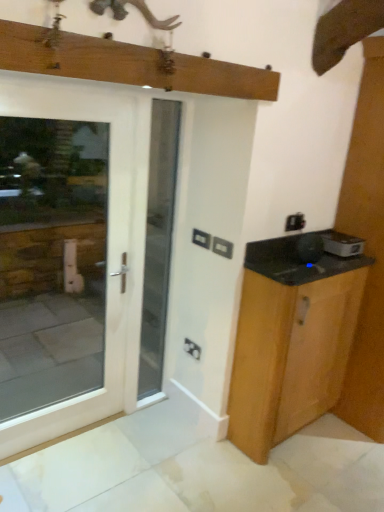
This screenshot has height=512, width=384. What are the coordinates of `wooden beam at upper center` in the screenshot? It's located at (129, 64).

Measure the distance between matte black electric outlet at center, which is the 1th electric outlet in bottom-to-top order, and camera.

matte black electric outlet at center, which is the 1th electric outlet in bottom-to-top order, and camera are 8.20 feet apart from each other.

What do you see at coordinates (192, 349) in the screenshot?
I see `matte black electric outlet at center, the 1th electric outlet viewed from the back` at bounding box center [192, 349].

The width and height of the screenshot is (384, 512). What do you see at coordinates (291, 339) in the screenshot? I see `wooden cabinet at right` at bounding box center [291, 339].

I want to click on black plastic electric outlet at center, the 2th electric outlet positioned from the bottom, so click(x=222, y=247).

What do you see at coordinates (62, 257) in the screenshot? This screenshot has width=384, height=512. I see `white wood door at left` at bounding box center [62, 257].

The width and height of the screenshot is (384, 512). What do you see at coordinates (158, 242) in the screenshot? I see `white glossy door at center` at bounding box center [158, 242].

This screenshot has height=512, width=384. What do you see at coordinates (201, 238) in the screenshot? I see `white plastic electric outlet at center, marked as the 2th electric outlet in a back-to-front arrangement` at bounding box center [201, 238].

Identify the location of wooden beam at upper center. (129, 64).

How different are the orientations of wooden cabinet at right and matte black electric outlet at center, which appears as the third electric outlet when viewed from the top, in degrees?

The angle between the facing direction of wooden cabinet at right and the facing direction of matte black electric outlet at center, which appears as the third electric outlet when viewed from the top, is 89.5 degrees.

Which of these two, wooden cabinet at right or matte black electric outlet at center, the 1th electric outlet viewed from the back, stands taller?

Standing taller between the two is wooden cabinet at right.

Does point (309, 353) lie behind point (188, 342)?

No.

From the image's perspective, starting from the white glossy microwave at right, which electric outlet is the 2nd one below? Please provide its 2D coordinates.

[(192, 349)]

Based on the photo, between white glossy microwave at right and matte black electric outlet at center, which appears as the third electric outlet when viewed from the top, which one appears on the right side from the viewer's perspective?

white glossy microwave at right is more to the right.

Which of these two, white glossy microwave at right or matte black electric outlet at center, which is the 1th electric outlet in bottom-to-top order, is wider?

With larger width is white glossy microwave at right.

From their relative heights in the image, would you say white glossy microwave at right is taller or shorter than matte black electric outlet at center, which is the 3th electric outlet from front to back?

In the image, white glossy microwave at right appears to be shorter than matte black electric outlet at center, which is the 3th electric outlet from front to back.

How many degrees apart are the facing directions of white wood door at left and white plastic electric outlet at center, which is counted as the second electric outlet, starting from the front?

88.5 degrees separate the facing orientations of white wood door at left and white plastic electric outlet at center, which is counted as the second electric outlet, starting from the front.

Is white wood door at left wider or thinner than white plastic electric outlet at center, which is counted as the second electric outlet, starting from the front?

Considering their sizes, white wood door at left looks broader than white plastic electric outlet at center, which is counted as the second electric outlet, starting from the front.

From a real-world perspective, does white wood door at left sit lower than white plastic electric outlet at center, which is counted as the second electric outlet, starting from the front?

Yes, from a real-world perspective, white wood door at left is below white plastic electric outlet at center, which is counted as the second electric outlet, starting from the front.

Is white wood door at left aimed at white plastic electric outlet at center, which is counted as the second electric outlet, starting from the front?

No, white wood door at left does not turn towards white plastic electric outlet at center, which is counted as the second electric outlet, starting from the front.

From the image's perspective, does white wood door at left appear lower than wooden beam at upper center?

Yes, from the image's perspective, white wood door at left is beneath wooden beam at upper center.

Does white wood door at left come behind wooden beam at upper center?

Yes.

From a real-world perspective, who is located lower, white wood door at left or wooden beam at upper center?

In real-world perspective, white wood door at left is lower.

Can you tell me how much white wood door at left and wooden beam at upper center differ in facing direction?

0.00685 degrees.

Is wooden beam at upper center thinner than white plastic electric outlet at center, the first electric outlet when ordered from top to bottom?

Incorrect, the width of wooden beam at upper center is not less than that of white plastic electric outlet at center, the first electric outlet when ordered from top to bottom.

How far apart are wooden beam at upper center and white plastic electric outlet at center, which is counted as the second electric outlet, starting from the front?

The distance of wooden beam at upper center from white plastic electric outlet at center, which is counted as the second electric outlet, starting from the front, is 38.62 inches.

Is wooden beam at upper center not inside white plastic electric outlet at center, which is counted as the second electric outlet, starting from the front?

Indeed, wooden beam at upper center is completely outside white plastic electric outlet at center, which is counted as the second electric outlet, starting from the front.

Is wooden beam at upper center not near white plastic electric outlet at center, marked as the 2th electric outlet in a back-to-front arrangement?

wooden beam at upper center is actually quite close to white plastic electric outlet at center, marked as the 2th electric outlet in a back-to-front arrangement.

Is white glossy microwave at right smaller than white plastic electric outlet at center, which is counted as the second electric outlet, starting from the front?

Incorrect, white glossy microwave at right is not smaller in size than white plastic electric outlet at center, which is counted as the second electric outlet, starting from the front.

Which of these two, white glossy microwave at right or white plastic electric outlet at center, the third electric outlet in the bottom-to-top sequence, stands shorter?

Standing shorter between the two is white plastic electric outlet at center, the third electric outlet in the bottom-to-top sequence.

From the image's perspective, between white glossy microwave at right and white plastic electric outlet at center, marked as the 2th electric outlet in a back-to-front arrangement, which one is located above?

white plastic electric outlet at center, marked as the 2th electric outlet in a back-to-front arrangement.

Find the location of `screen door above the wooden cabinet at right (from a real-world perspective)`. screen door above the wooden cabinet at right (from a real-world perspective) is located at coordinates coord(158,242).

In terms of width, does wooden cabinet at right look wider or thinner when compared to white glossy door at center?

Considering their sizes, wooden cabinet at right looks broader than white glossy door at center.

Does point (246, 314) come in front of point (142, 347)?

Yes, point (246, 314) is closer to viewer.

Consider the image. Between wooden cabinet at right and white glossy door at center, which one has larger size?

wooden cabinet at right.

Find the location of a particular element. cabinetry lying above the matte black electric outlet at center, which is the 1th electric outlet in bottom-to-top order (from the image's perspective) is located at coordinates (291, 339).

At what (x,y) coordinates should I click in order to perform the action: click on appliance above the matte black electric outlet at center, which is the 3th electric outlet from front to back (from a real-world perspective). Please return your answer as a coordinate pair (x, y). Looking at the image, I should click on (342, 244).

In the scene shown: Based on their spatial positions, is white glossy door at center or wooden cabinet at right further from white wood door at left?

wooden cabinet at right.

Based on their spatial positions, is matte black electric outlet at center, which appears as the third electric outlet when viewed from the top, or white plastic electric outlet at center, which is counted as the second electric outlet, starting from the front, further from wooden cabinet at right?

Among the two, white plastic electric outlet at center, which is counted as the second electric outlet, starting from the front, is located further to wooden cabinet at right.

Looking at the image, which one is located closer to white glossy door at center, black plastic electric outlet at center, acting as the third electric outlet starting from the back, or matte black electric outlet at center, which is the 3th electric outlet from front to back?

Based on the image, matte black electric outlet at center, which is the 3th electric outlet from front to back, appears to be nearer to white glossy door at center.

When comparing their distances from white glossy microwave at right, does white plastic electric outlet at center, marked as the 2th electric outlet in a back-to-front arrangement, or matte black electric outlet at center, which is the 3th electric outlet from front to back, seem closer?

Based on the image, white plastic electric outlet at center, marked as the 2th electric outlet in a back-to-front arrangement, appears to be nearer to white glossy microwave at right.

Based on the photo, from the image, which object appears to be farther from white plastic electric outlet at center, the third electric outlet in the bottom-to-top sequence, black plastic electric outlet at center, acting as the third electric outlet starting from the back, or white glossy microwave at right?

white glossy microwave at right.

Looking at this image, based on their spatial positions, is black plastic electric outlet at center, the second electric outlet in the top-to-bottom sequence, or wooden cabinet at right further from white glossy microwave at right?

black plastic electric outlet at center, the second electric outlet in the top-to-bottom sequence.

When comparing their distances from white wood door at left, does white plastic electric outlet at center, marked as the 2th electric outlet in a back-to-front arrangement, or white glossy microwave at right seem further?

Among the two, white glossy microwave at right is located further to white wood door at left.

Based on their spatial positions, is white plastic electric outlet at center, marked as the 2th electric outlet in a back-to-front arrangement, or wooden cabinet at right closer to wooden beam at upper center?

The object closer to wooden beam at upper center is white plastic electric outlet at center, marked as the 2th electric outlet in a back-to-front arrangement.

Locate an element on the screen. This screenshot has height=512, width=384. electric outlet positioned between wooden beam at upper center and white plastic electric outlet at center, the third electric outlet in the bottom-to-top sequence, from near to far is located at coordinates (222, 247).

Locate an element on the screen. This screenshot has height=512, width=384. screen door between white plastic electric outlet at center, the first electric outlet when ordered from top to bottom, and matte black electric outlet at center, which appears as the third electric outlet when viewed from the top, in the vertical direction is located at coordinates (158, 242).

Where is `screen door between black plastic electric outlet at center, the second electric outlet in the top-to-bottom sequence, and matte black electric outlet at center, which is the 3th electric outlet from front to back, from top to bottom`? The width and height of the screenshot is (384, 512). screen door between black plastic electric outlet at center, the second electric outlet in the top-to-bottom sequence, and matte black electric outlet at center, which is the 3th electric outlet from front to back, from top to bottom is located at coordinates (158, 242).

Locate an element on the screen. This screenshot has height=512, width=384. door located between wooden beam at upper center and black plastic electric outlet at center, the second electric outlet in the top-to-bottom sequence, in the depth direction is located at coordinates (62, 257).